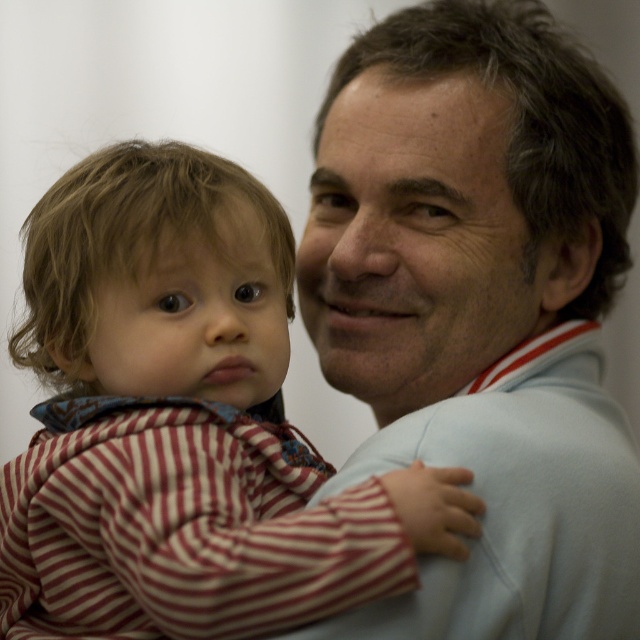
You are a photographer trying to capture a closeup of the light blue sweater at upper right and the striped cotton onesie at left. Which one should you focus on first if you want to capture both in the same frame?

The striped cotton onesie at left should be focused on first because the light blue sweater at upper right is positioned on the right side of it, so adjusting focus from left to right would ensure both are captured.

Looking at this image, you are standing in front of the image and want to know the distance to the point marked as point (477, 358). Can you tell me how far it is from where you are standing?

The point (477, 358) is 34.53 inches away from the viewer, so the distance is 34.53 inches.